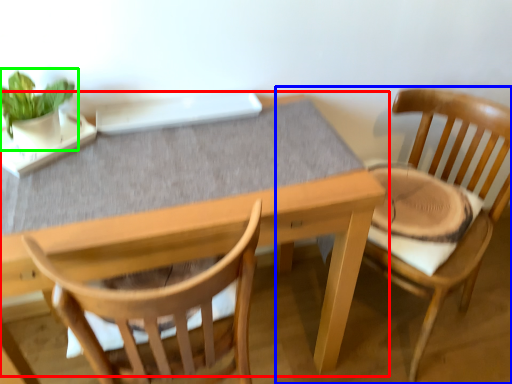
Question: Considering the real-world distances, which object is farthest from table (highlighted by a red box)? chair (highlighted by a blue box) or houseplant (highlighted by a green box)?

Choices:
 (A) chair
 (B) houseplant

Answer: (B)